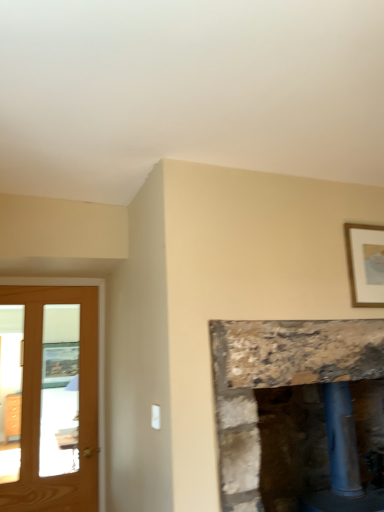
Describe the element at coordinates (365, 264) in the screenshot. I see `gold wooden picture frame at upper right` at that location.

Image resolution: width=384 pixels, height=512 pixels. Find the location of `rustic stone fireplace at center`. rustic stone fireplace at center is located at coordinates (278, 380).

Measure the distance between point (265, 373) and camera.

1.71 meters.

I want to click on gold wooden picture frame at upper right, so click(365, 264).

Considering the relative sizes of rustic stone fireplace at center and light brown wooden screen door at left in the image provided, is rustic stone fireplace at center shorter than light brown wooden screen door at left?

Yes, rustic stone fireplace at center is shorter than light brown wooden screen door at left.

From the image's perspective, is rustic stone fireplace at center over light brown wooden screen door at left?

No, from the image's perspective, rustic stone fireplace at center is not on top of light brown wooden screen door at left.

At what (x,y) coordinates should I click in order to perform the action: click on fireplace in front of the light brown wooden screen door at left. Please return your answer as a coordinate pair (x, y). Image resolution: width=384 pixels, height=512 pixels. Looking at the image, I should click on (278, 380).

Is rustic stone fireplace at center spatially inside light brown wooden screen door at left, or outside of it?

rustic stone fireplace at center is located beyond the bounds of light brown wooden screen door at left.

From a real-world perspective, between gold wooden picture frame at upper right and rustic stone fireplace at center, who is vertically lower?

rustic stone fireplace at center, from a real-world perspective.

How different are the orientations of gold wooden picture frame at upper right and rustic stone fireplace at center in degrees?

The facing directions of gold wooden picture frame at upper right and rustic stone fireplace at center are 1.1 degrees apart.

Which point is more forward, (x=380, y=267) or (x=231, y=413)?

The point (x=231, y=413) is closer to the camera.

What are the coordinates of `fireplace below the gold wooden picture frame at upper right (from the image's perspective)` in the screenshot? It's located at (278, 380).

From the image's perspective, which one is positioned higher, light brown wooden screen door at left or rustic stone fireplace at center?

light brown wooden screen door at left.

Does light brown wooden screen door at left come behind rustic stone fireplace at center?

Yes.

From a real-world perspective, does light brown wooden screen door at left stand above rustic stone fireplace at center?

Correct, in the physical world, light brown wooden screen door at left is higher than rustic stone fireplace at center.

Is light brown wooden screen door at left wider than rustic stone fireplace at center?

No, light brown wooden screen door at left is not wider than rustic stone fireplace at center.

Between light brown wooden screen door at left and gold wooden picture frame at upper right, which one has smaller width?

With smaller width is gold wooden picture frame at upper right.

Is light brown wooden screen door at left smaller than gold wooden picture frame at upper right?

Actually, light brown wooden screen door at left might be larger than gold wooden picture frame at upper right.

Between light brown wooden screen door at left and gold wooden picture frame at upper right, which one has less height?

gold wooden picture frame at upper right is shorter.

From a real-world perspective, is rustic stone fireplace at center physically located above or below gold wooden picture frame at upper right?

rustic stone fireplace at center is situated lower than gold wooden picture frame at upper right in the real world.

Considering the relative sizes of rustic stone fireplace at center and gold wooden picture frame at upper right in the image provided, is rustic stone fireplace at center wider than gold wooden picture frame at upper right?

Indeed, rustic stone fireplace at center has a greater width compared to gold wooden picture frame at upper right.

Is rustic stone fireplace at center outside of gold wooden picture frame at upper right?

Indeed, rustic stone fireplace at center is completely outside gold wooden picture frame at upper right.

Are rustic stone fireplace at center and gold wooden picture frame at upper right far apart?

No, rustic stone fireplace at center is not far away from gold wooden picture frame at upper right.

From a real-world perspective, is gold wooden picture frame at upper right located beneath light brown wooden screen door at left?

No.

Looking at this image, considering the relative sizes of gold wooden picture frame at upper right and light brown wooden screen door at left in the image provided, is gold wooden picture frame at upper right shorter than light brown wooden screen door at left?

Yes, gold wooden picture frame at upper right is shorter than light brown wooden screen door at left.

In terms of size, does gold wooden picture frame at upper right appear bigger or smaller than light brown wooden screen door at left?

Considering their sizes, gold wooden picture frame at upper right takes up less space than light brown wooden screen door at left.

Which object is positioned more to the left, gold wooden picture frame at upper right or light brown wooden screen door at left?

light brown wooden screen door at left is more to the left.

This screenshot has height=512, width=384. I want to click on fireplace below the light brown wooden screen door at left (from the image's perspective), so click(x=278, y=380).

I want to click on picture frame above the rustic stone fireplace at center (from the image's perspective), so click(x=365, y=264).

Looking at the image, which one is located further to rustic stone fireplace at center, gold wooden picture frame at upper right or light brown wooden screen door at left?

The object further to rustic stone fireplace at center is light brown wooden screen door at left.

Which object lies further to the anchor point light brown wooden screen door at left, gold wooden picture frame at upper right or rustic stone fireplace at center?

Based on the image, gold wooden picture frame at upper right appears to be further to light brown wooden screen door at left.

Looking at the image, which one is located further to light brown wooden screen door at left, rustic stone fireplace at center or gold wooden picture frame at upper right?

gold wooden picture frame at upper right is further to light brown wooden screen door at left.

Estimate the real-world distances between objects in this image. Which object is further from gold wooden picture frame at upper right, light brown wooden screen door at left or rustic stone fireplace at center?

The object further to gold wooden picture frame at upper right is light brown wooden screen door at left.

Which object lies further to the anchor point rustic stone fireplace at center, light brown wooden screen door at left or gold wooden picture frame at upper right?

light brown wooden screen door at left is further to rustic stone fireplace at center.

Considering their positions, is rustic stone fireplace at center positioned closer to gold wooden picture frame at upper right than light brown wooden screen door at left?

rustic stone fireplace at center is closer to gold wooden picture frame at upper right.

Locate an element on the screen. picture frame between light brown wooden screen door at left and rustic stone fireplace at center in the horizontal direction is located at coordinates (365, 264).